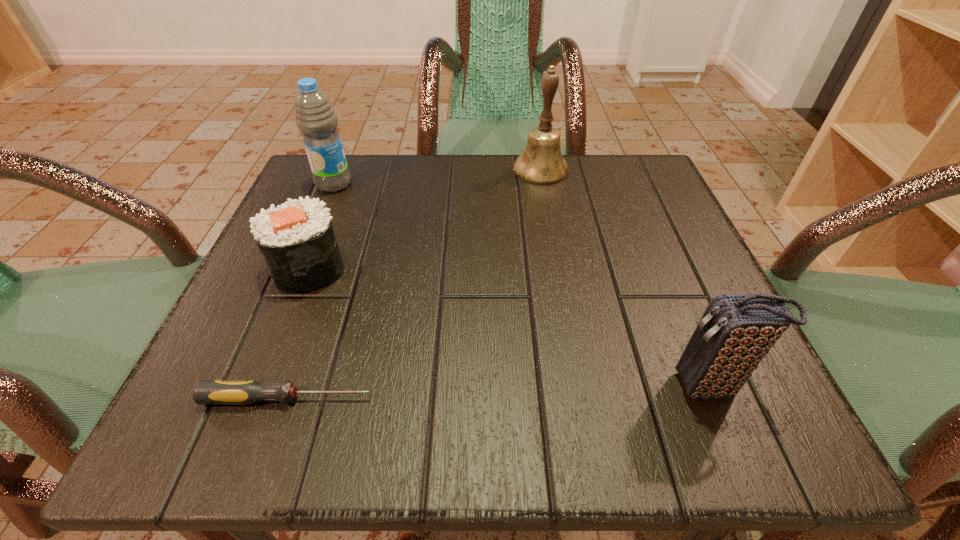
Identify the location of screwdriver at the left edge. (241, 392).

Find the location of a particular element. This screenshot has width=960, height=540. object that is at the right edge is located at coordinates (735, 333).

Where is `object positioned at the far left corner`? object positioned at the far left corner is located at coordinates (315, 117).

In order to click on object positioned at the near left corner in this screenshot , I will do `click(241, 392)`.

Locate an element on the screen. object that is positioned at the near right corner is located at coordinates (735, 333).

Locate an element on the screen. The width and height of the screenshot is (960, 540). vacant area at the far edge is located at coordinates (571, 189).

In the image, there is a desktop. Where is `vacant space at the near edge`? vacant space at the near edge is located at coordinates (446, 396).

This screenshot has height=540, width=960. What are the coordinates of `free space at the left edge of the desktop` in the screenshot? It's located at (300, 330).

This screenshot has height=540, width=960. Identify the location of vacant space at the right edge of the desktop. (650, 301).

Find the location of a particular element. The width and height of the screenshot is (960, 540). vacant space at the far left corner of the desktop is located at coordinates (305, 195).